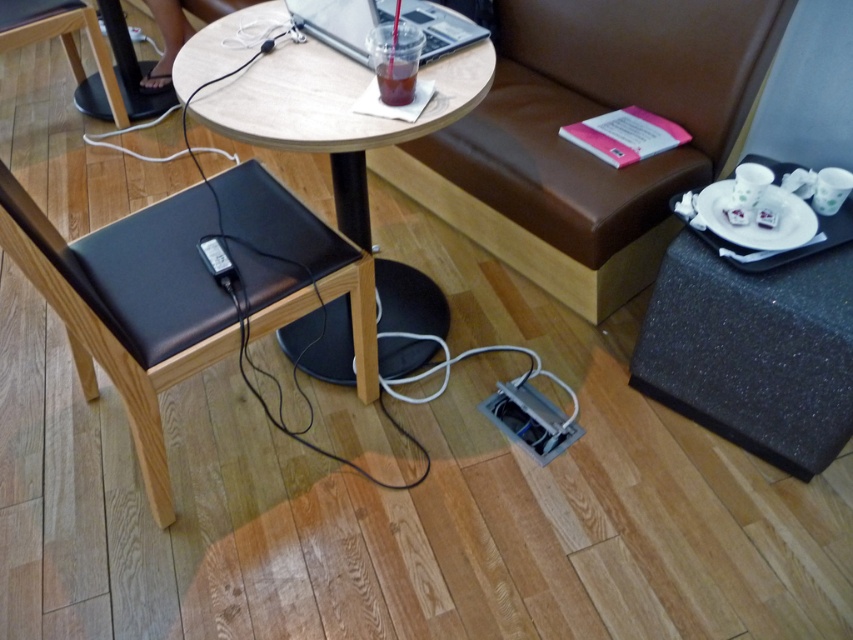
You are sitting on the black cushioned chair on the left and want to reach the brown leather couch at upper center. Based on their positions, can you estimate whether the couch is closer to the wall behind you or the entrance in front of you?

The brown leather couch at upper center is located at point (583, 150), which suggests it is closer to the entrance in front of you rather than the wall behind the chair.

You are a customer at this cozy indoor setting and want to place both the wooden table at center and the translucent plastic cup at center on a shelf. The shelf can only hold items that are smaller than 1 meter in diameter. Can both items fit?

The wooden table at center has a larger size compared to translucent plastic cup at center. However, without specific measurements, it is impossible to determine if both items fit on the shelf since the exact dimensions of the wooden table at center and translucent plastic cup at center are not provided.

You are a person sitting on the brown leather couch at upper center and you want to reach the translucent plastic cup at center. Can you comfortably reach it without moving from your seat?

The brown leather couch at upper center and the translucent plastic cup at center are 31.21 inches apart from each other. Since the average comfortable reaching distance for an adult is about 24 to 30 inches, you might need to stretch a bit but it should be possible to reach the translucent plastic cup at center from the brown leather couch at upper center.